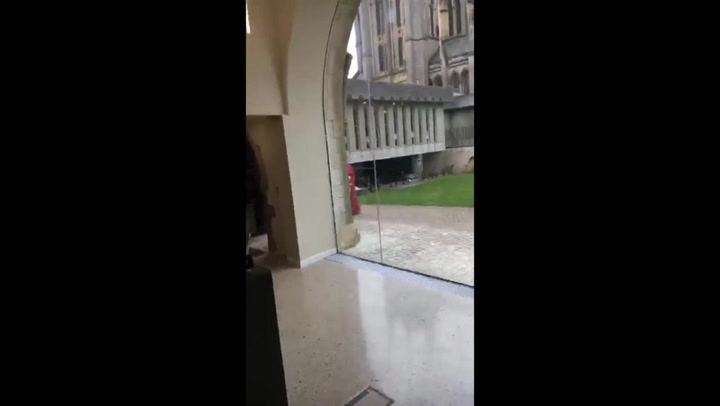
At what (x,y) coordinates should I click in order to perform the action: click on walkway support column. Please return your answer as a coordinate pair (x, y). The width and height of the screenshot is (720, 406). Looking at the image, I should click on [x=418, y=166].